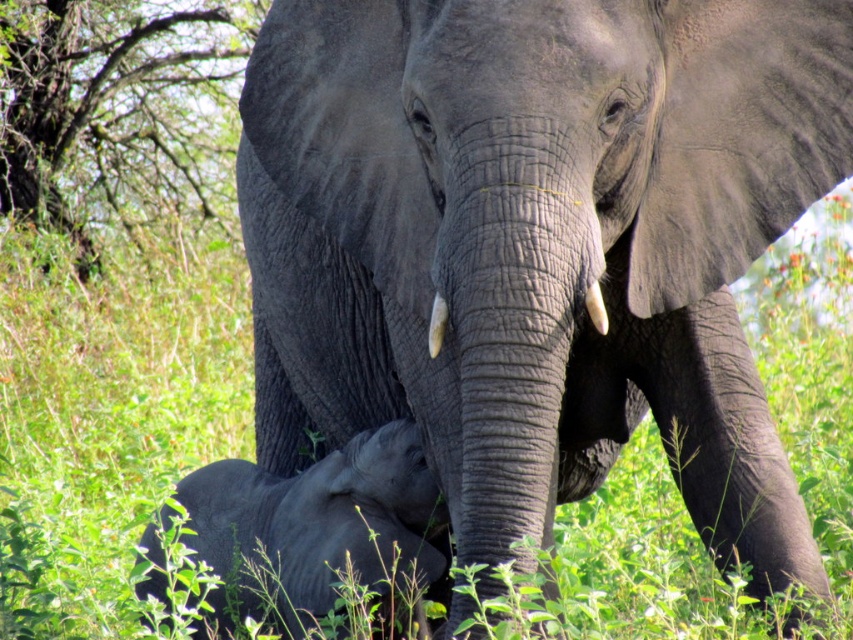
Does gray matte elephant at center have a greater width compared to white matte tusk at center?

Indeed, gray matte elephant at center has a greater width compared to white matte tusk at center.

Is gray matte elephant at center bigger than white matte tusk at center?

Correct, gray matte elephant at center is larger in size than white matte tusk at center.

Who is more distant from viewer, (541, 497) or (433, 326)?

The point (433, 326) is behind.

What are the coordinates of `gray matte elephant at center` in the screenshot? It's located at (537, 243).

Who is lower down, gray matte elephant at lower left or white smooth tusk at center?

gray matte elephant at lower left is lower down.

Is point (381, 486) more distant than point (587, 292)?

Yes, it is behind point (587, 292).

What do you see at coordinates (316, 524) in the screenshot?
I see `gray matte elephant at lower left` at bounding box center [316, 524].

In order to click on gray matte elephant at lower left in this screenshot , I will do `click(316, 524)`.

Is gray matte elephant at center behind gray matte elephant at lower left?

No, it is not.

Based on the photo, which is more to the left, gray matte elephant at center or gray matte elephant at lower left?

Positioned to the left is gray matte elephant at lower left.

Find the location of a particular element. This screenshot has height=640, width=853. gray matte elephant at center is located at coordinates (537, 243).